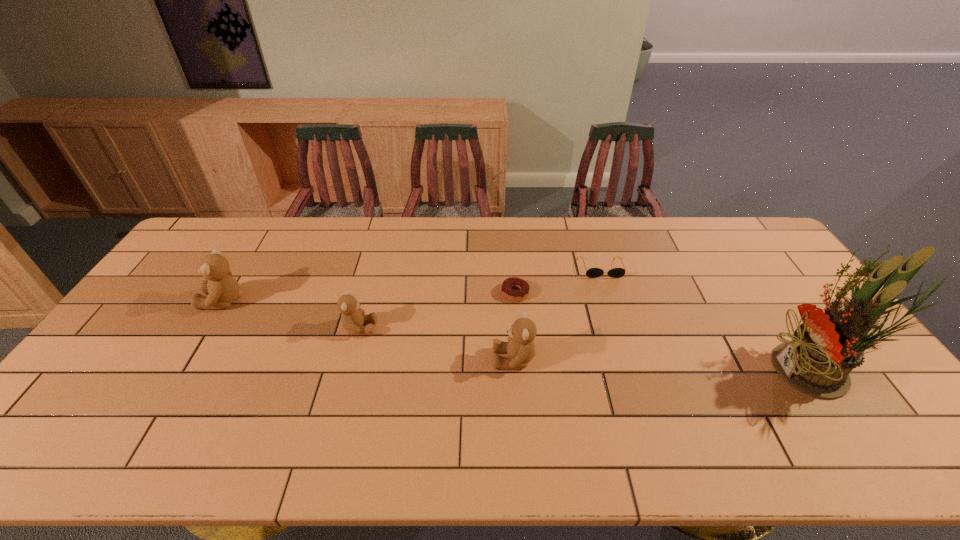
At what (x,y) coordinates should I click in order to perform the action: click on blank region between the fifth object from right to left and the shortest object. Please return your answer as a coordinate pair (x, y). Looking at the image, I should click on (438, 310).

Where is `free area in between the rightmost object and the shortest object`? The image size is (960, 540). free area in between the rightmost object and the shortest object is located at coordinates (667, 332).

Where is `free space that is in between the flower arrangement and the second tallest teddy bear`? free space that is in between the flower arrangement and the second tallest teddy bear is located at coordinates (666, 366).

Identify the location of free point between the rightmost object and the fifth object from right to left. (589, 350).

I want to click on vacant area between the second nearest teddy bear and the leftmost teddy bear, so click(292, 314).

Point out which object is positioned as the second nearest to the tallest object. Please provide its 2D coordinates. Your answer should be formatted as a tuple, i.e. [(x, y)], where the tuple contains the x and y coordinates of a point satisfying the conditions above.

[(520, 347)]

Identify which object is the third closest to the doughnut. Please provide its 2D coordinates. Your answer should be formatted as a tuple, i.e. [(x, y)], where the tuple contains the x and y coordinates of a point satisfying the conditions above.

[(352, 318)]

Locate an element on the screen. The image size is (960, 540). the second closest teddy bear to the nearest teddy bear is located at coordinates (222, 289).

Locate an element on the screen. The image size is (960, 540). teddy bear that is the second closest to the rightmost object is located at coordinates (352, 318).

Image resolution: width=960 pixels, height=540 pixels. What are the coordinates of `free point that satisfies the following two spatial constraints: 1. on the front side of the doughnut; 2. on the front-facing side of the shortest teddy bear` in the screenshot? It's located at (518, 328).